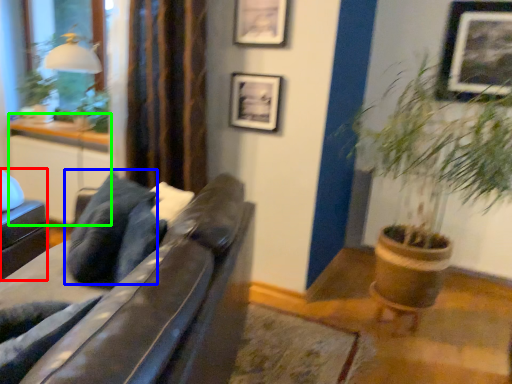
Question: Which is farther away from swivel chair (highlighted by a red box)? pillow (highlighted by a blue box) or table (highlighted by a green box)?

Choices:
 (A) pillow
 (B) table

Answer: (A)